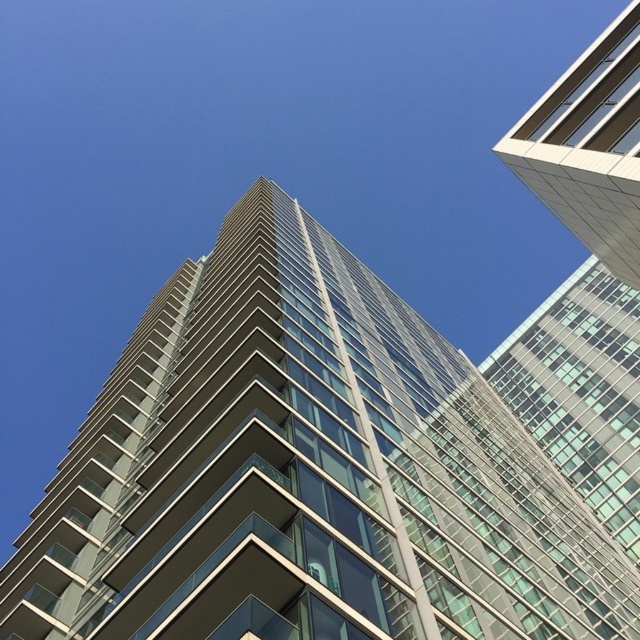
Looking at this image, you are a drone operator tasked with flying a drone between the glassy steel building at center and the white glass building at upper right. The drone has a wingspan of 2 meters. Can the drone safely navigate the space between them without crashing into either building?

The distance between the glassy steel building at center and the white glass building at upper right is 28.25 meters. Since the drone has a wingspan of 2 meters, it can safely navigate the space between them as the distance is more than sufficient to accommodate the drone.

You are standing in the middle of a city park and see both the glassy steel building at center and the white glass building at upper right. Which building would appear larger to you?

A: The glassy steel building at center appears larger because it is closer to the viewer than the white glass building at upper right.

You are an architect planning to install a solar panel array between the glassy steel building at center and the white glass building at upper right. Based on their positions, which building will cast a shadow over the other during midday? Please explain your reasoning.

The glassy steel building at center is positioned under the white glass building at upper right. Since the white glass building at upper right is higher and located above, it will cast a shadow over the glassy steel building at center during midday when the sun is directly overhead.